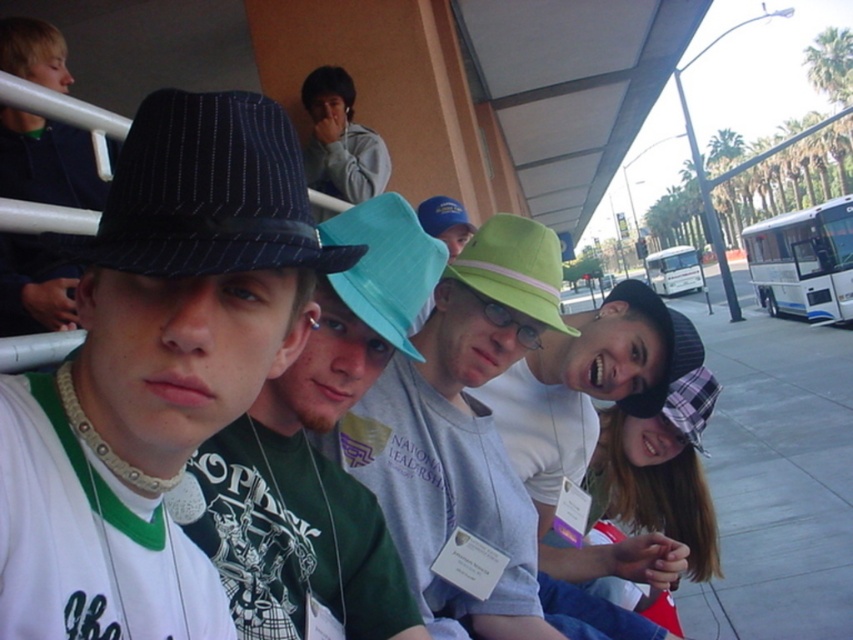
Question: Among these points, which one is farthest from the camera?

Choices:
 (A) [x=497, y=225]
 (B) [x=467, y=225]
 (C) [x=338, y=195]

Answer: (B)

Question: Which of the following is the closest to the observer?

Choices:
 (A) black pinstripe fedora at center
 (B) teal fabric bucket hat at center
 (C) white glossy bus at right
 (D) green fabric hat at center

Answer: (A)

Question: Can you confirm if light green fabric hat at center is positioned above white glossy bus at right?

Choices:
 (A) no
 (B) yes

Answer: (A)

Question: Does black pinstripe fedora at center appear under green fabric hat at center?

Choices:
 (A) yes
 (B) no

Answer: (B)

Question: Can you confirm if light green fabric hat at center is positioned above blue fabric cap at center?

Choices:
 (A) yes
 (B) no

Answer: (B)

Question: Which point appears farthest from the camera in this image?

Choices:
 (A) (341, 97)
 (B) (469, 508)
 (C) (691, 353)

Answer: (A)